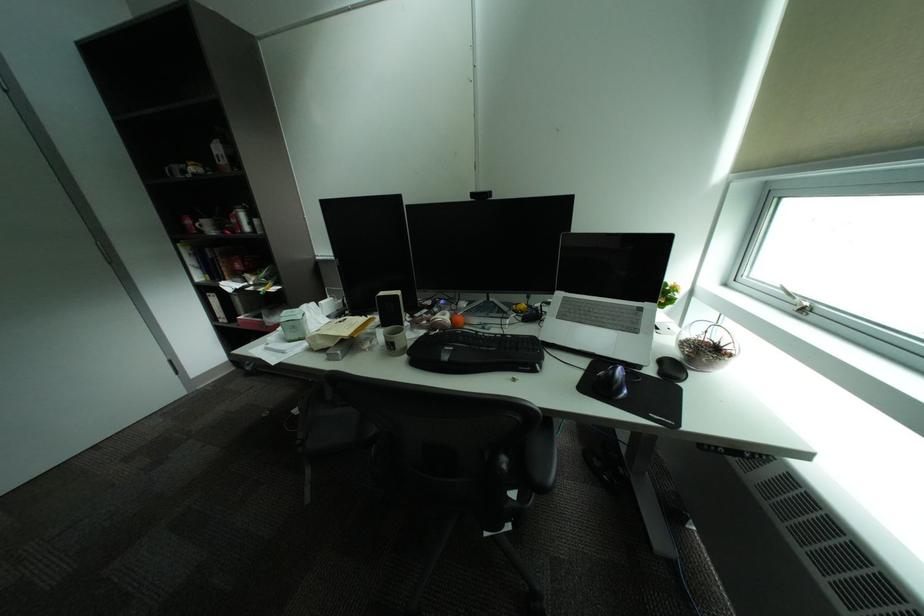
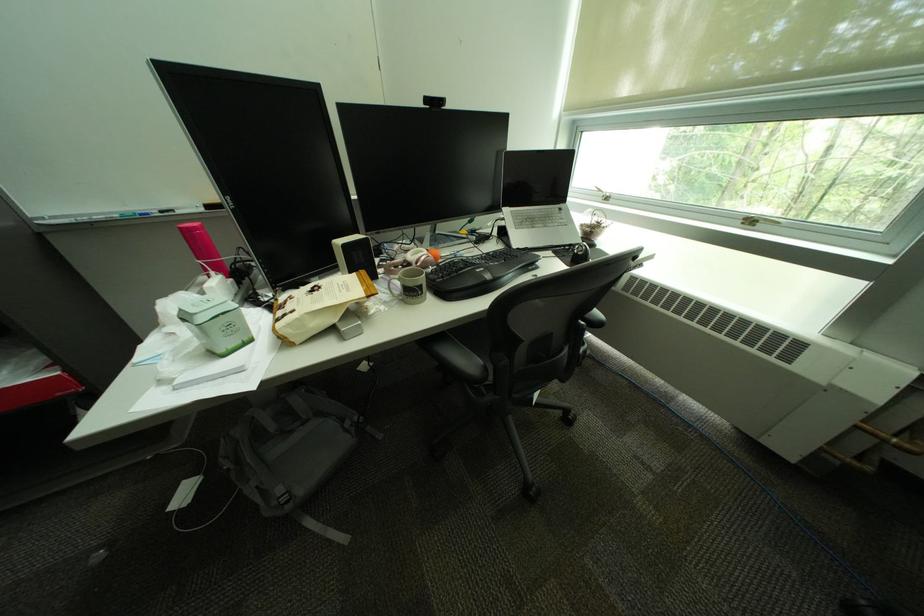
Where in the second image is the point corresponding to (299,339) from the first image?

(232, 353)